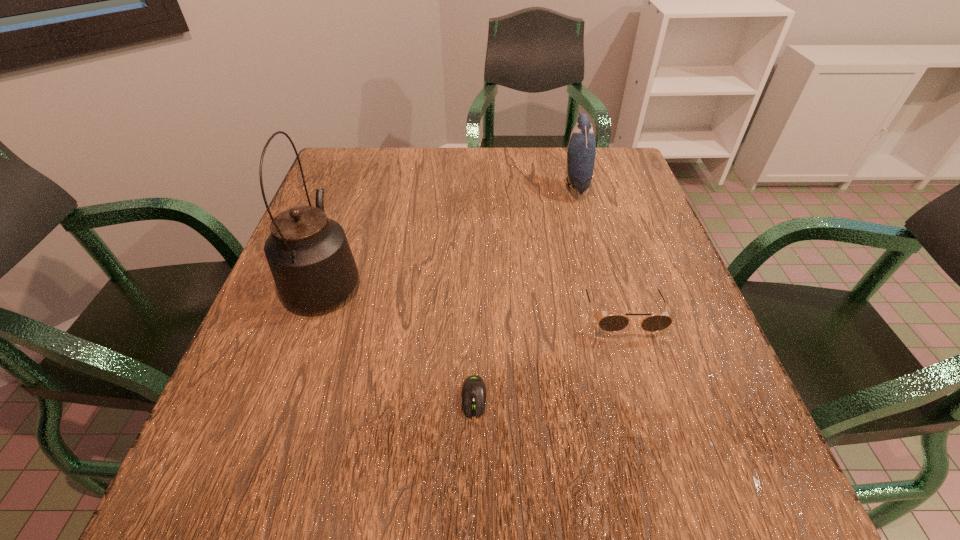
Where is `free location at the far edge`? The width and height of the screenshot is (960, 540). free location at the far edge is located at coordinates (555, 166).

Where is `free space at the near edge`? free space at the near edge is located at coordinates (607, 511).

Find the location of a particular element. This screenshot has height=540, width=960. vacant area at the left edge of the desktop is located at coordinates (280, 406).

Find the location of a particular element. Image resolution: width=960 pixels, height=540 pixels. vacant space at the right edge is located at coordinates (633, 345).

At what (x,y) coordinates should I click in order to perform the action: click on free space at the far left corner of the desktop. Please return your answer as a coordinate pair (x, y). Looking at the image, I should click on (373, 159).

Where is `vacant area at the near right corner`? The image size is (960, 540). vacant area at the near right corner is located at coordinates tap(750, 481).

Identify the location of vacant point located between the second shortest object and the farthest object. click(x=598, y=249).

Identify the location of free space between the computer mouse and the bird. (524, 291).

You are a GUI agent. You are given a task and a screenshot of the screen. Output one action in this format:
    pyautogui.click(x=<x>, y=<y>)
    Task: Click on the free point between the shortest object and the sunglasses
    This screenshot has width=960, height=540.
    Given the screenshot: What is the action you would take?
    pyautogui.click(x=548, y=355)

I want to click on vacant point located between the kettle and the second tallest object, so click(450, 232).